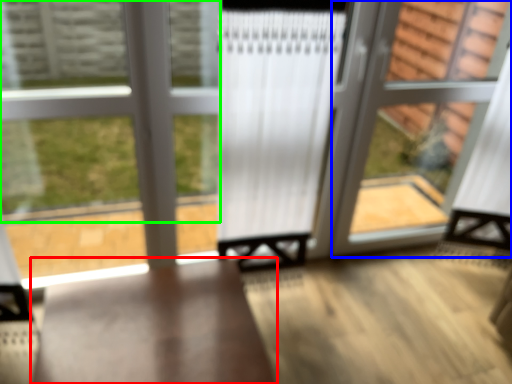
Question: Estimate the real-world distances between objects in this image. Which object is farther from furniture (highlighted by a red box), screen door (highlighted by a blue box) or bay window (highlighted by a green box)?

Choices:
 (A) screen door
 (B) bay window

Answer: (A)